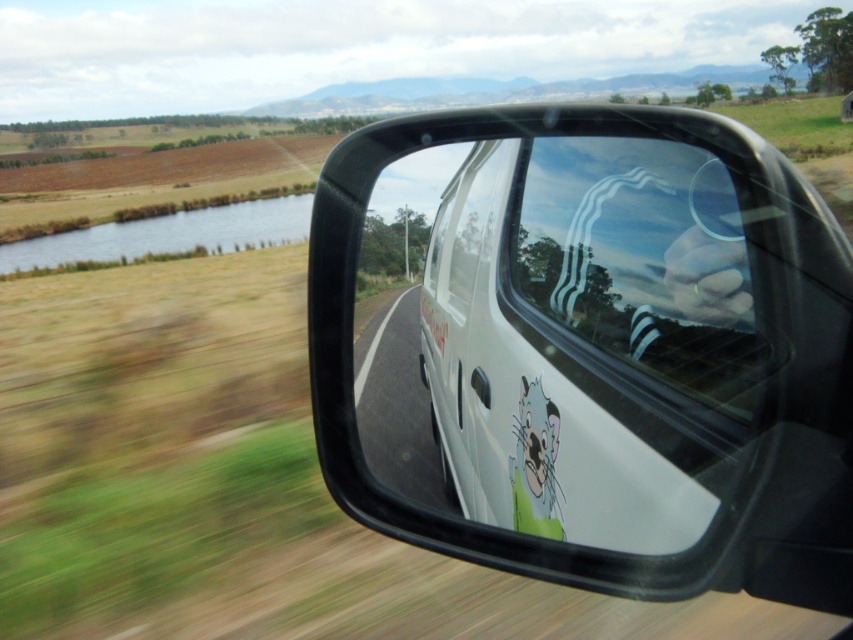
Question: Which point is farther to the camera?

Choices:
 (A) (548, 461)
 (B) (407, 394)
 (C) (730, 358)

Answer: (B)

Question: Can you confirm if clear glass window at center is wider than cartoon cat sticker at lower center?

Choices:
 (A) no
 (B) yes

Answer: (B)

Question: Is black plastic mirror at center smaller than clear glass window at center?

Choices:
 (A) no
 (B) yes

Answer: (A)

Question: Which point is farther to the camera?

Choices:
 (A) (532, 406)
 (B) (689, 180)

Answer: (A)

Question: Among these points, which one is farthest from the camera?

Choices:
 (A) pos(642,154)
 (B) pos(425,378)
 (C) pos(547,468)

Answer: (B)

Question: Is black plastic mirror at center thinner than clear glass window at center?

Choices:
 (A) yes
 (B) no

Answer: (B)